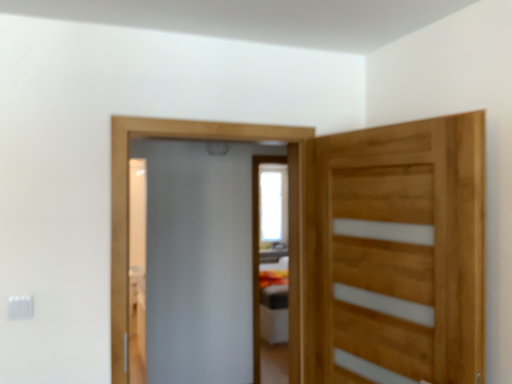
Question: Can you confirm if white glossy screen door at center, which is the first screen door from back to front, is wider than natural wood door at right?

Choices:
 (A) yes
 (B) no

Answer: (A)

Question: From the image's perspective, is white glossy screen door at center, which is the first screen door from back to front, on natural wood door at right?

Choices:
 (A) yes
 (B) no

Answer: (B)

Question: Can you confirm if white glossy screen door at center, which is the first screen door from back to front, is shorter than natural wood door at right?

Choices:
 (A) no
 (B) yes

Answer: (A)

Question: From a real-world perspective, is white glossy screen door at center, the second screen door positioned from the front, over natural wood door at right?

Choices:
 (A) yes
 (B) no

Answer: (B)

Question: Is white glossy screen door at center, which is the first screen door from back to front, turned away from natural wood door at right?

Choices:
 (A) yes
 (B) no

Answer: (B)

Question: Looking at their shapes, would you say frosted glass screen door at center, the 1th screen door positioned from the front, is wider or thinner than white glossy screen door at center, which is the first screen door from back to front?

Choices:
 (A) thin
 (B) wide

Answer: (A)

Question: Is frosted glass screen door at center, the second screen door from the back, in front of or behind white glossy screen door at center, which is the first screen door from back to front, in the image?

Choices:
 (A) front
 (B) behind

Answer: (A)

Question: Considering the positions of point (247, 306) and point (256, 337), is point (247, 306) closer or farther from the camera than point (256, 337)?

Choices:
 (A) closer
 (B) farther

Answer: (A)

Question: In the image, is frosted glass screen door at center, the second screen door from the back, on the left side or the right side of white glossy screen door at center, which is the first screen door from back to front?

Choices:
 (A) right
 (B) left

Answer: (B)

Question: Looking at their shapes, would you say frosted glass screen door at center, the second screen door from the back, is wider or thinner than natural wood door at right?

Choices:
 (A) wide
 (B) thin

Answer: (A)

Question: Is frosted glass screen door at center, the second screen door from the back, inside or outside of natural wood door at right?

Choices:
 (A) inside
 (B) outside

Answer: (B)

Question: Does point (205, 357) appear closer or farther from the camera than point (415, 198)?

Choices:
 (A) closer
 (B) farther

Answer: (B)

Question: From a real-world perspective, relative to natural wood door at right, is frosted glass screen door at center, the second screen door from the back, vertically above or below?

Choices:
 (A) above
 (B) below

Answer: (B)

Question: From a real-world perspective, is white glossy screen door at center, which is the first screen door from back to front, positioned above or below natural wood door at right?

Choices:
 (A) below
 (B) above

Answer: (A)

Question: Is white glossy screen door at center, the second screen door positioned from the front, taller or shorter than natural wood door at right?

Choices:
 (A) short
 (B) tall

Answer: (B)